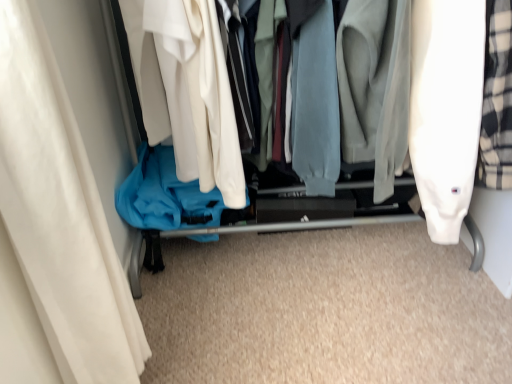
At what (x,y) coordinates should I click in order to perform the action: click on white fabric curtain at left. Please return your answer as a coordinate pair (x, y). Image resolution: width=512 pixels, height=384 pixels. Looking at the image, I should click on (60, 213).

The width and height of the screenshot is (512, 384). What do you see at coordinates (60, 213) in the screenshot? I see `white fabric curtain at left` at bounding box center [60, 213].

Measure the distance between point (58, 254) and camera.

Point (58, 254) and camera are 68.60 centimeters apart from each other.

What do you see at coordinates (437, 103) in the screenshot? I see `matte blue fabric at center` at bounding box center [437, 103].

Locate an element on the screen. matte blue fabric at center is located at coordinates (437, 103).

Where is `white fabric curtain at left`? This screenshot has width=512, height=384. white fabric curtain at left is located at coordinates (60, 213).

Can you confirm if matte blue fabric at center is positioned to the right of white fabric curtain at left?

Correct, you'll find matte blue fabric at center to the right of white fabric curtain at left.

Looking at this image, is matte blue fabric at center in front of or behind white fabric curtain at left in the image?

matte blue fabric at center is behind white fabric curtain at left.

Between point (506, 174) and point (66, 253), which one is positioned in front?

Positioned in front is point (66, 253).

In the scene shown: From the image's perspective, would you say matte blue fabric at center is shown under white fabric curtain at left?

Incorrect, from the image's perspective, matte blue fabric at center is higher than white fabric curtain at left.

From a real-world perspective, who is located lower, matte blue fabric at center or white fabric curtain at left?

matte blue fabric at center, from a real-world perspective.

Is matte blue fabric at center thinner than white fabric curtain at left?

In fact, matte blue fabric at center might be wider than white fabric curtain at left.

Is matte blue fabric at center taller or shorter than white fabric curtain at left?

matte blue fabric at center is taller than white fabric curtain at left.

Who is smaller, matte blue fabric at center or white fabric curtain at left?

white fabric curtain at left.

Does matte blue fabric at center contain white fabric curtain at left?

No, white fabric curtain at left is located outside of matte blue fabric at center.

Are matte blue fabric at center and white fabric curtain at left located far from each other?

No, matte blue fabric at center is in close proximity to white fabric curtain at left.

Could you tell me if matte blue fabric at center is turned towards white fabric curtain at left?

Yes, matte blue fabric at center is oriented towards white fabric curtain at left.

This screenshot has height=384, width=512. What are the coordinates of `closet below the white fabric curtain at left (from a real-world perspective)` in the screenshot? It's located at (437, 103).

Is white fabric curtain at left at the left side of matte blue fabric at center?

Correct, you'll find white fabric curtain at left to the left of matte blue fabric at center.

Considering the positions of objects white fabric curtain at left and matte blue fabric at center in the image provided, who is in front, white fabric curtain at left or matte blue fabric at center?

white fabric curtain at left is more forward.

Does point (80, 336) come closer to viewer compared to point (426, 209)?

That is True.

In the scene shown: From the image's perspective, is white fabric curtain at left located beneath matte blue fabric at center?

Indeed, from the image's perspective, white fabric curtain at left is shown beneath matte blue fabric at center.

From a real-world perspective, relative to matte blue fabric at center, is white fabric curtain at left vertically above or below?

Clearly, from a real-world perspective, white fabric curtain at left is above matte blue fabric at center.

Does white fabric curtain at left have a greater width compared to matte blue fabric at center?

Incorrect, the width of white fabric curtain at left does not surpass that of matte blue fabric at center.

Looking at this image, considering the sizes of objects white fabric curtain at left and matte blue fabric at center in the image provided, who is shorter, white fabric curtain at left or matte blue fabric at center?

white fabric curtain at left.

Is white fabric curtain at left bigger than matte blue fabric at center?

No.

Is matte blue fabric at center a part of white fabric curtain at left?

Actually, matte blue fabric at center is outside white fabric curtain at left.

Is white fabric curtain at left far from matte blue fabric at center?

No, white fabric curtain at left is in close proximity to matte blue fabric at center.

Is matte blue fabric at center at the back of white fabric curtain at left?

No.

What's the angular difference between white fabric curtain at left and matte blue fabric at center's facing directions?

The angular difference between white fabric curtain at left and matte blue fabric at center is 89.9 degrees.

This screenshot has width=512, height=384. Identify the location of closet behind the white fabric curtain at left. (437, 103).

In the image, there is a white fabric curtain at left. Where is `closet above it (from the image's perspective)`? Image resolution: width=512 pixels, height=384 pixels. closet above it (from the image's perspective) is located at coordinates (437, 103).

Where is `curtain above the matte blue fabric at center (from a real-world perspective)`? curtain above the matte blue fabric at center (from a real-world perspective) is located at coordinates (60, 213).